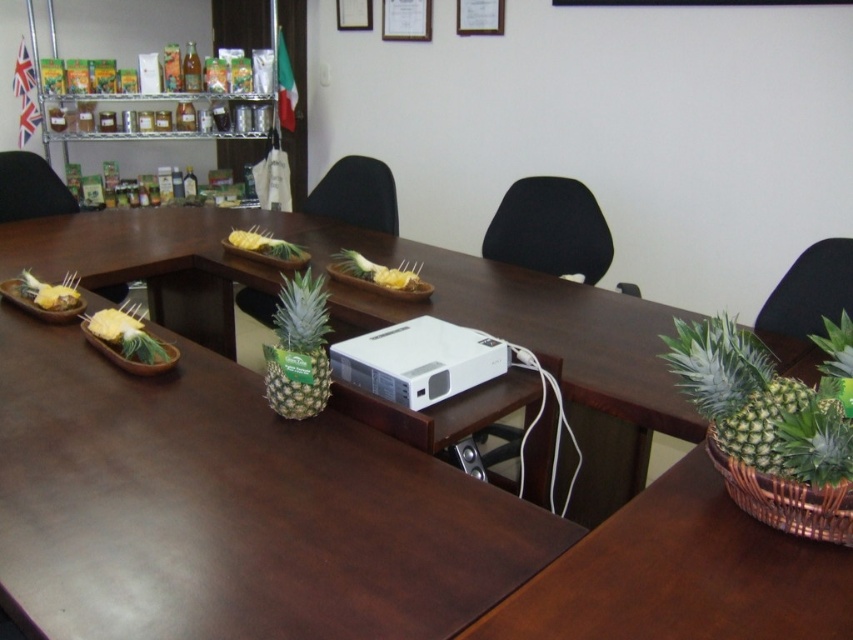
Between black fabric chair at center and black leather chair at left, which one has less height?

black leather chair at left

Which is above, black fabric chair at center or black leather chair at left?

Positioned higher is black leather chair at left.

Locate an element on the screen. The height and width of the screenshot is (640, 853). black fabric chair at center is located at coordinates (550, 228).

You are a GUI agent. You are given a task and a screenshot of the screen. Output one action in this format:
    pyautogui.click(x=<x>, y=<y>)
    Task: Click on the black fabric chair at center
    
    Given the screenshot: What is the action you would take?
    pyautogui.click(x=550, y=228)

Consider the image. Can you confirm if brown wood table at lower right is positioned above yellow-green pineapple at center?

No, brown wood table at lower right is not above yellow-green pineapple at center.

Can you confirm if brown wood table at lower right is taller than yellow-green pineapple at center?

Yes, brown wood table at lower right is taller than yellow-green pineapple at center.

Does point (662, 634) come behind point (126, 320)?

No, (662, 634) is in front of (126, 320).

Locate an element on the screen. This screenshot has height=640, width=853. brown wood table at lower right is located at coordinates (682, 573).

Can you confirm if brown wood table at lower right is positioned below wooden tray at left?

Indeed, brown wood table at lower right is positioned under wooden tray at left.

Can you confirm if brown wood table at lower right is bigger than wooden tray at left?

Correct, brown wood table at lower right is larger in size than wooden tray at left.

Does point (537, 625) come farther from viewer compared to point (53, 310)?

No, it is in front of (53, 310).

Identify the location of brown wood table at lower right. tap(682, 573).